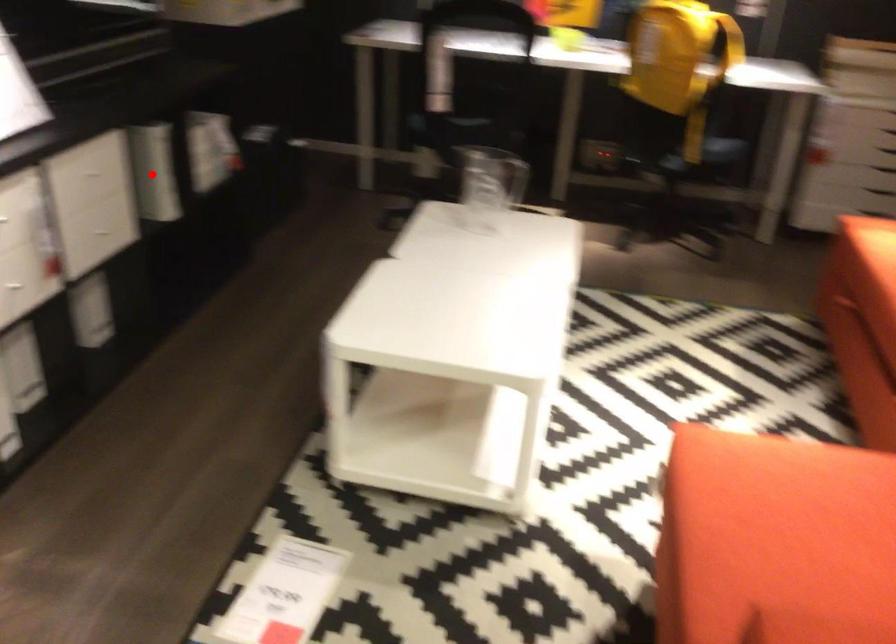
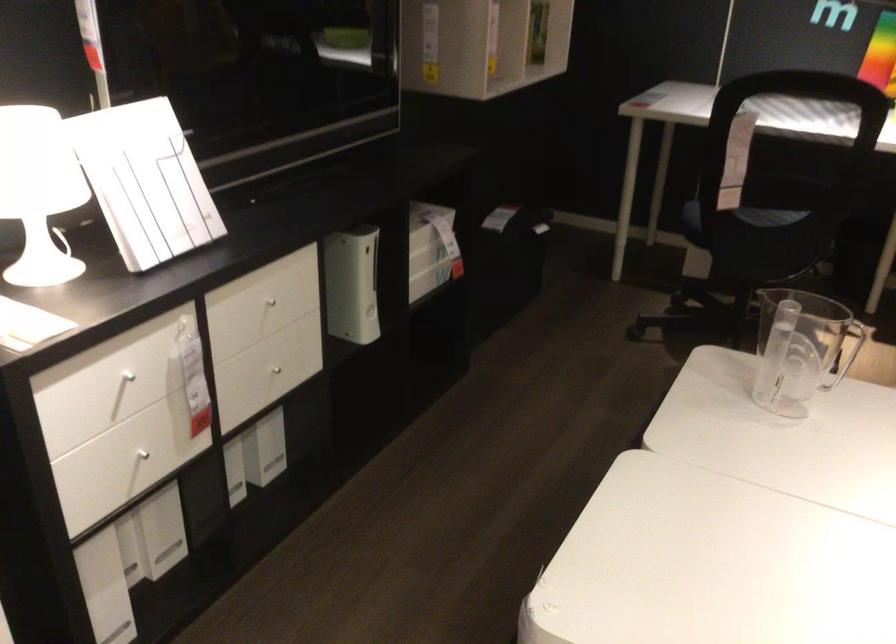
Question: I am providing you with two images of the same scene from different viewpoints. In image1, a red point is highlighted. Considering the same 3D point in image2, which of the following is correct?

Choices:
 (A) It is closer
 (B) It is farther

Answer: (A)